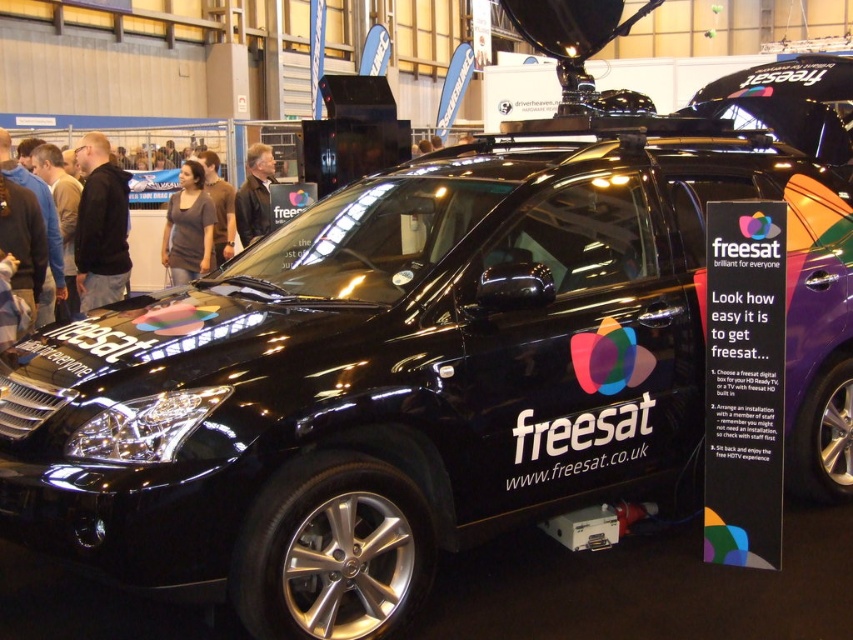
What is located at the coordinates point (x=189, y=227)?

The gray matte shirt at center is located at point (x=189, y=227).

You are standing at the camera position and want to reach the point marked at coordinates point (126, 230). Can you walk directly to it without needing to move any obstacles?

The point (126, 230) is 21.14 feet away from the camera, so you can walk directly to it without needing to move any obstacles.

You are at a trade show and see the black SUV with freesat branding. You notice two items on a table near the SUV. One is a gray matte shirt at center and the other is a leather jacket at center. Which item is positioned lower on the table?

The gray matte shirt at center is located below the leather jacket at center, so the gray matte shirt at center is positioned lower on the table.